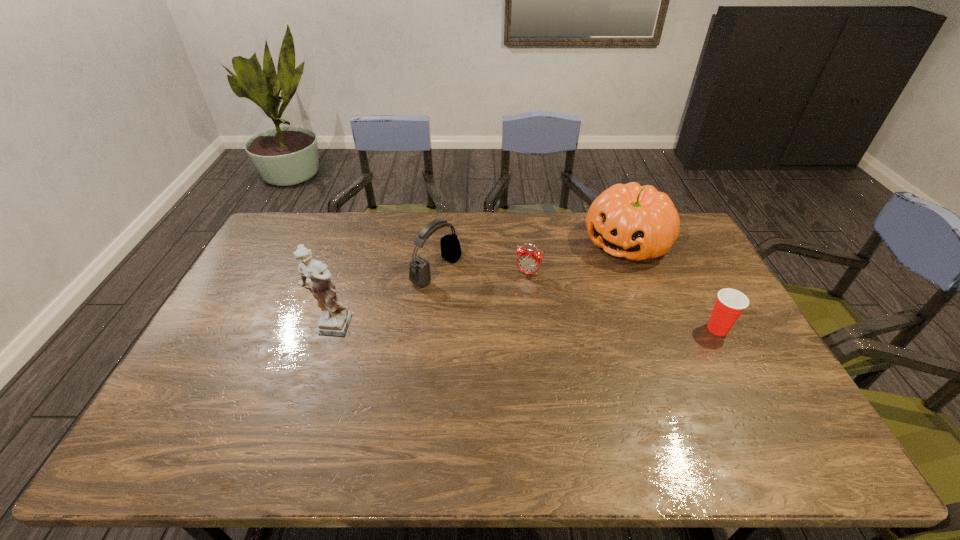
This screenshot has width=960, height=540. In order to click on the tallest object in this screenshot , I will do `click(335, 318)`.

Find the location of a particular element. The height and width of the screenshot is (540, 960). figurine is located at coordinates (335, 318).

You are a GUI agent. You are given a task and a screenshot of the screen. Output one action in this format:
    pyautogui.click(x=<x>, y=<y>)
    Task: Click on the Dixie cup
    
    Given the screenshot: What is the action you would take?
    pyautogui.click(x=730, y=303)

Where is `the second object from left to right`? The height and width of the screenshot is (540, 960). the second object from left to right is located at coordinates pos(419,269).

In order to click on the third object from left to right in this screenshot , I will do `click(529, 261)`.

You are a GUI agent. You are given a task and a screenshot of the screen. Output one action in this format:
    pyautogui.click(x=<x>, y=<y>)
    Task: Click on the pumpkin
    
    Given the screenshot: What is the action you would take?
    pyautogui.click(x=636, y=222)

Identify the location of free location located on the front-facing side of the figurine. The height and width of the screenshot is (540, 960). (309, 392).

The image size is (960, 540). What are the coordinates of `vacant space located 0.250m on the front of the Dixie cup` in the screenshot? It's located at (765, 418).

The height and width of the screenshot is (540, 960). What are the coordinates of `vacant space situated 0.060m on the headband of the headset` in the screenshot? It's located at (469, 290).

You are a GUI agent. You are given a task and a screenshot of the screen. Output one action in this format:
    pyautogui.click(x=<x>, y=<y>)
    Task: Click on the vacant region located 0.170m on the headband of the headset
    The height and width of the screenshot is (540, 960).
    Given the screenshot: What is the action you would take?
    click(x=497, y=305)